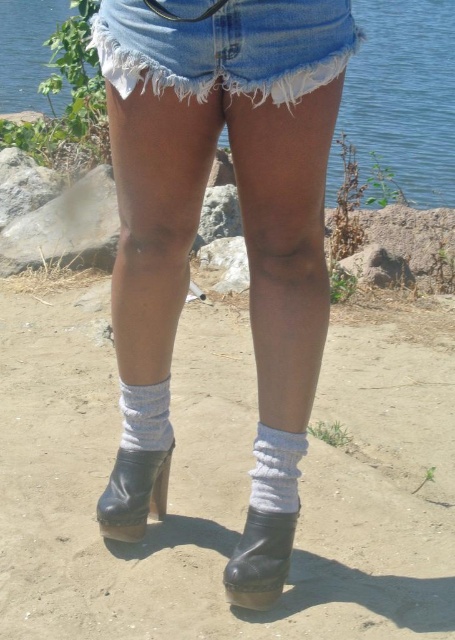
Question: Which of the following is the closest to the observer?

Choices:
 (A) white knitted sock at center
 (B) white cotton socks at center
 (C) white cotton shorts at upper center
 (D) blue denim shorts at upper center

Answer: (C)

Question: Among these objects, which one is nearest to the camera?

Choices:
 (A) blue denim shorts at upper center
 (B) white knitted sock at center
 (C) white cotton shorts at upper center

Answer: (C)

Question: Based on their relative distances, which object is farther from the black leather boot at lower center?

Choices:
 (A) white knitted sock at center
 (B) white knitted sock at lower center
 (C) blue denim shorts at upper center
 (D) white cotton socks at center

Answer: (C)

Question: Does white cotton shorts at upper center appear on the right side of black leather cowboy boot at lower center?

Choices:
 (A) no
 (B) yes

Answer: (B)

Question: Does white cotton socks at center have a smaller size compared to white knitted sock at lower center?

Choices:
 (A) yes
 (B) no

Answer: (B)

Question: Observing the image, what is the correct spatial positioning of white cotton socks at center in reference to black leather boot at lower center?

Choices:
 (A) right
 (B) left

Answer: (B)